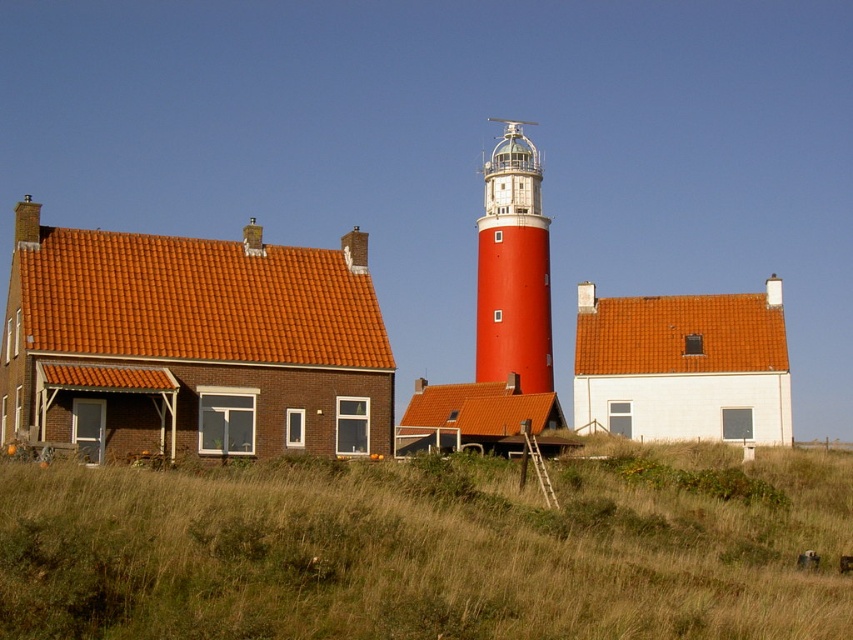
Question: Does dry grass at center appear on the right side of smooth red lighthouse at center?

Choices:
 (A) yes
 (B) no

Answer: (B)

Question: Which point appears closest to the camera in this image?

Choices:
 (A) (502, 308)
 (B) (589, 586)

Answer: (B)

Question: Among these objects, which one is farthest from the camera?

Choices:
 (A) smooth red lighthouse at center
 (B) dry grass at center

Answer: (A)

Question: Is dry grass at center wider than smooth red lighthouse at center?

Choices:
 (A) no
 (B) yes

Answer: (B)

Question: Which of the following is the closest to the observer?

Choices:
 (A) (488, 273)
 (B) (735, 573)

Answer: (B)

Question: Does dry grass at center have a smaller size compared to smooth red lighthouse at center?

Choices:
 (A) no
 (B) yes

Answer: (B)